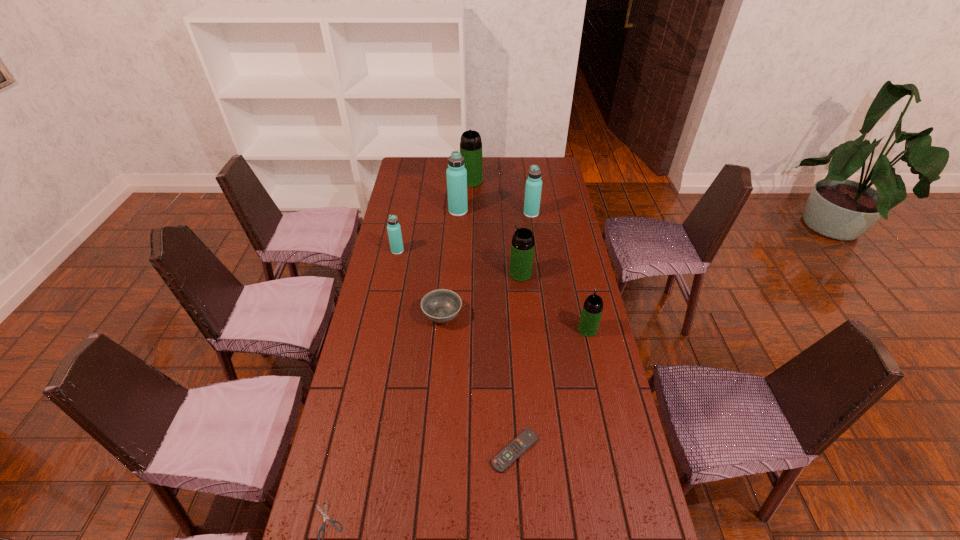
Locate an element on the screen. vacant space located 0.320m from the spout of the smallest green thermos bottle is located at coordinates (572, 262).

Image resolution: width=960 pixels, height=540 pixels. I want to click on vacant point located 0.150m from the spout of the smallest green thermos bottle, so click(x=579, y=292).

The height and width of the screenshot is (540, 960). I want to click on vacant space located 0.060m from the spout of the smallest green thermos bottle, so click(583, 310).

What are the coordinates of `vacant area situated on the right of the nearest aqua thermos bottle` in the screenshot? It's located at (478, 251).

Where is `vacant space positioned on the front of the third shortest object`? The height and width of the screenshot is (540, 960). vacant space positioned on the front of the third shortest object is located at coordinates (434, 422).

The height and width of the screenshot is (540, 960). I want to click on free space located 0.380m on the left of the eighth farthest object, so click(x=355, y=451).

Find the location of a particular element. The image size is (960, 540). object that is at the far edge is located at coordinates (470, 144).

Find the location of a particular element. The height and width of the screenshot is (540, 960). object located at the left edge is located at coordinates (394, 231).

Where is `blank area at the far edge`? This screenshot has width=960, height=540. blank area at the far edge is located at coordinates coord(487,165).

Find the location of a particular element. This screenshot has height=540, width=960. free space at the left edge of the desktop is located at coordinates (408, 284).